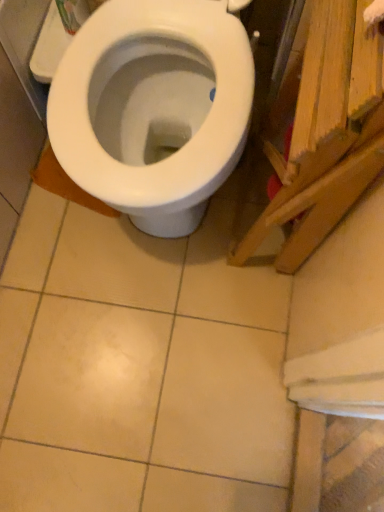
Question: Could you tell me if wooden plank at right is facing white glossy bidet at center?

Choices:
 (A) no
 (B) yes

Answer: (A)

Question: From the image's perspective, would you say wooden plank at right is positioned over white glossy bidet at center?

Choices:
 (A) no
 (B) yes

Answer: (A)

Question: Can you confirm if wooden plank at right is bigger than white glossy bidet at center?

Choices:
 (A) yes
 (B) no

Answer: (B)

Question: Is wooden plank at right taller than white glossy bidet at center?

Choices:
 (A) yes
 (B) no

Answer: (A)

Question: Would you say wooden plank at right contains white glossy bidet at center?

Choices:
 (A) yes
 (B) no

Answer: (B)

Question: Can you confirm if wooden plank at right is thinner than white glossy bidet at center?

Choices:
 (A) no
 (B) yes

Answer: (B)

Question: Considering the relative sizes of white glossy bidet at center and wooden plank at right in the image provided, is white glossy bidet at center taller than wooden plank at right?

Choices:
 (A) no
 (B) yes

Answer: (A)

Question: Would you say white glossy bidet at center contains wooden plank at right?

Choices:
 (A) no
 (B) yes

Answer: (A)

Question: Could you tell me if white glossy bidet at center is facing wooden plank at right?

Choices:
 (A) yes
 (B) no

Answer: (B)

Question: Can you confirm if white glossy bidet at center is positioned to the left of wooden plank at right?

Choices:
 (A) no
 (B) yes

Answer: (B)

Question: Considering the relative positions of white glossy bidet at center and wooden plank at right in the image provided, is white glossy bidet at center to the right of wooden plank at right from the viewer's perspective?

Choices:
 (A) no
 (B) yes

Answer: (A)

Question: From the image's perspective, is white glossy bidet at center on wooden plank at right?

Choices:
 (A) yes
 (B) no

Answer: (A)

Question: Based on their positions, is white glossy bidet at center located to the left or right of wooden plank at right?

Choices:
 (A) left
 (B) right

Answer: (A)